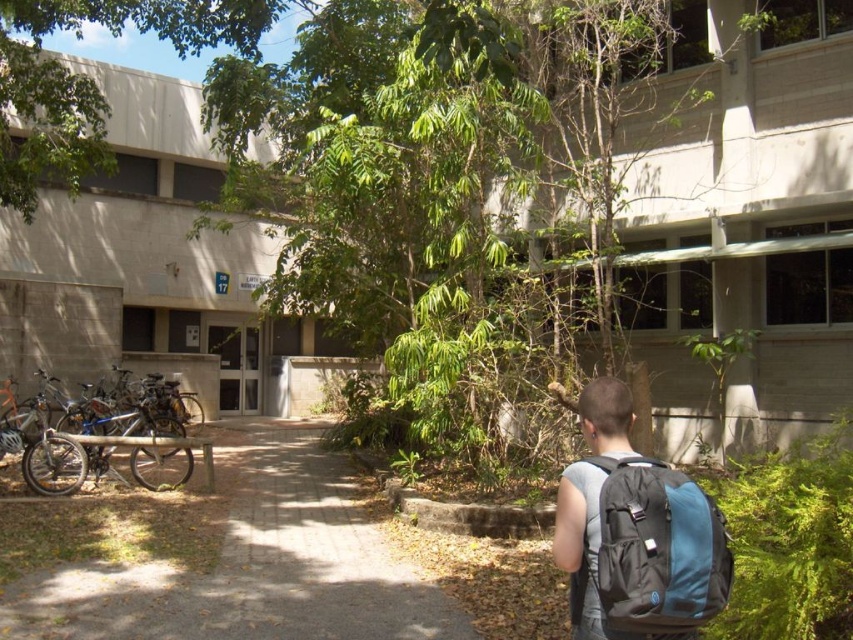
Does green leafy tree at upper center come in front of teal fabric backpack at lower right?

No, it is behind teal fabric backpack at lower right.

Is green leafy tree at upper center thinner than teal fabric backpack at lower right?

No, green leafy tree at upper center is not thinner than teal fabric backpack at lower right.

Does point (90, 17) come in front of point (641, 541)?

No, (90, 17) is behind (641, 541).

This screenshot has width=853, height=640. In order to click on green leafy tree at upper center in this screenshot , I will do `click(91, 77)`.

This screenshot has width=853, height=640. Describe the element at coordinates (252, 566) in the screenshot. I see `brick paved path at center` at that location.

Between brick paved path at center and silver metallic bicycle at left, which one has less height?

Standing shorter between the two is brick paved path at center.

Is point (466, 627) positioned behind point (86, 442)?

That is False.

Where is `brick paved path at center`? brick paved path at center is located at coordinates (x=252, y=566).

Can you confirm if teal fabric backpack at lower right is bigger than silver metallic bicycle at left?

Incorrect, teal fabric backpack at lower right is not larger than silver metallic bicycle at left.

Is point (693, 483) positioned behind point (67, 422)?

No, it is not.

The image size is (853, 640). I want to click on teal fabric backpack at lower right, so (x=651, y=552).